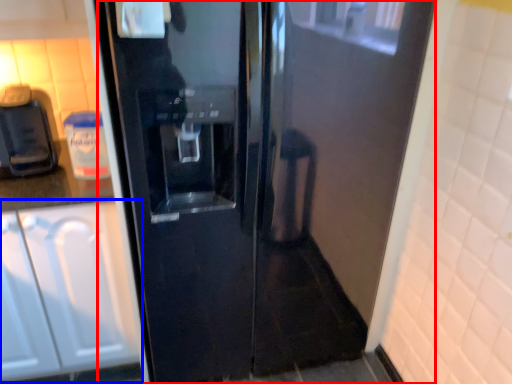
Question: Which point is further to the camera, door (highlighted by a red box) or cabinetry (highlighted by a blue box)?

Choices:
 (A) door
 (B) cabinetry

Answer: (B)